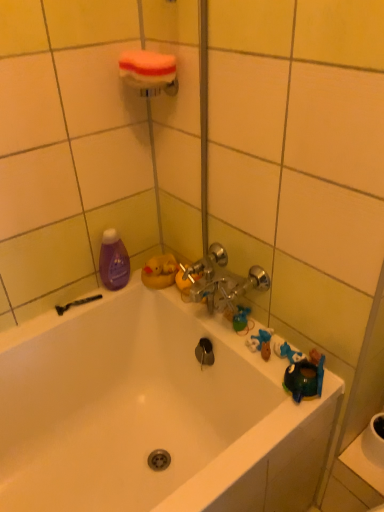
This screenshot has width=384, height=512. What do you see at coordinates (364, 464) in the screenshot?
I see `white glossy sink at lower right` at bounding box center [364, 464].

Image resolution: width=384 pixels, height=512 pixels. I want to click on white foam sponge at upper center, so click(x=149, y=72).

This screenshot has width=384, height=512. Find the location of `white glossy sink at lower right`. white glossy sink at lower right is located at coordinates (364, 464).

Can you confirm if purple glossy bottle at left is wider than white glossy sink at lower right?

Incorrect, the width of purple glossy bottle at left does not surpass that of white glossy sink at lower right.

Which object is closer to the camera, purple glossy bottle at left or white glossy sink at lower right?

white glossy sink at lower right.

Locate an element on the screen. cleaning product on the left of white glossy sink at lower right is located at coordinates (113, 261).

In terms of height, does white glossy sink at lower right look taller or shorter compared to purple glossy bottle at left?

In the image, white glossy sink at lower right appears to be shorter than purple glossy bottle at left.

Consider the image. From a real-world perspective, who is located higher, white glossy sink at lower right or purple glossy bottle at left?

purple glossy bottle at left, from a real-world perspective.

Would you say white glossy sink at lower right is a long distance from purple glossy bottle at left?

They are positioned close to each other.

Which is behind, point (303, 450) or point (381, 489)?

The point (381, 489) is more distant.

From the picture: What's the angular difference between white glossy bathtub at center and white glossy sink at lower right's facing directions?

The angle between the facing direction of white glossy bathtub at center and the facing direction of white glossy sink at lower right is 88.8 degrees.

Between white glossy bathtub at center and white glossy sink at lower right, which one has larger size?

With larger size is white glossy bathtub at center.

Is white glossy bathtub at center positioned with its back to white glossy sink at lower right?

No, white glossy sink at lower right is not at the back of white glossy bathtub at center.

In the scene shown: In the image, is white foam sponge at upper center on the left side or the right side of white glossy sink at lower right?

In the image, white foam sponge at upper center appears on the left side of white glossy sink at lower right.

Does white foam sponge at upper center contain white glossy sink at lower right?

No, white glossy sink at lower right is not inside white foam sponge at upper center.

From a real-world perspective, who is located higher, white foam sponge at upper center or white glossy sink at lower right?

white foam sponge at upper center, from a real-world perspective.

Considering the sizes of objects white foam sponge at upper center and purple glossy bottle at left in the image provided, who is thinner, white foam sponge at upper center or purple glossy bottle at left?

purple glossy bottle at left.

Is the position of white foam sponge at upper center more distant than that of purple glossy bottle at left?

No, it is not.

From the image's perspective, between white foam sponge at upper center and purple glossy bottle at left, which one is located above?

From the image's view, white foam sponge at upper center is above.

This screenshot has height=512, width=384. I want to click on towel bar that is above the white glossy bathtub at center (from a real-world perspective), so click(x=149, y=72).

Considering the positions of objects white glossy bathtub at center and white foam sponge at upper center in the image provided, who is behind, white glossy bathtub at center or white foam sponge at upper center?

white foam sponge at upper center is behind.

Who is shorter, white glossy bathtub at center or white foam sponge at upper center?

white foam sponge at upper center.

Can you tell me how much white glossy bathtub at center and white foam sponge at upper center differ in facing direction?

The facing directions of white glossy bathtub at center and white foam sponge at upper center are 89.6 degrees apart.

How different are the orientations of white glossy bathtub at center and purple glossy bottle at left in degrees?

There is a 0.0319-degree angle between the facing directions of white glossy bathtub at center and purple glossy bottle at left.

Looking at this image, is white glossy bathtub at center far from purple glossy bottle at left?

No, white glossy bathtub at center is in close proximity to purple glossy bottle at left.

The height and width of the screenshot is (512, 384). In order to click on cleaning product that appears on the left of white glossy bathtub at center in this screenshot , I will do `click(113, 261)`.

Between point (108, 455) and point (113, 257), which one is positioned in front?

The point (113, 257) is in front.

I want to click on sink below the purple glossy bottle at left (from a real-world perspective), so click(x=364, y=464).

I want to click on sink on the right of the purple glossy bottle at left, so click(364, 464).

Based on their spatial positions, is white glossy sink at lower right or white glossy bathtub at center closer to white foam sponge at upper center?

Based on the image, white glossy bathtub at center appears to be nearer to white foam sponge at upper center.

Estimate the real-world distances between objects in this image. Which object is further from purple glossy bottle at left, white glossy sink at lower right or white foam sponge at upper center?

white glossy sink at lower right is positioned further to the anchor purple glossy bottle at left.

Looking at the image, which one is located further to white glossy sink at lower right, purple glossy bottle at left or white foam sponge at upper center?

Based on the image, white foam sponge at upper center appears to be further to white glossy sink at lower right.

From the image, which object appears to be farther from white glossy sink at lower right, purple glossy bottle at left or white glossy bathtub at center?

Based on the image, purple glossy bottle at left appears to be further to white glossy sink at lower right.

Based on their spatial positions, is white foam sponge at upper center or white glossy sink at lower right further from white glossy bathtub at center?

The object further to white glossy bathtub at center is white foam sponge at upper center.

Looking at the image, which one is located closer to white glossy bathtub at center, white glossy sink at lower right or purple glossy bottle at left?

purple glossy bottle at left is positioned closer to the anchor white glossy bathtub at center.

Looking at the image, which one is located further to white glossy bathtub at center, purple glossy bottle at left or white glossy sink at lower right?

The object further to white glossy bathtub at center is white glossy sink at lower right.

Estimate the real-world distances between objects in this image. Which object is further from purple glossy bottle at left, white glossy bathtub at center or white glossy sink at lower right?

Based on the image, white glossy sink at lower right appears to be further to purple glossy bottle at left.

This screenshot has height=512, width=384. I want to click on bathtub between white foam sponge at upper center and white glossy sink at lower right vertically, so click(x=152, y=413).

The height and width of the screenshot is (512, 384). In order to click on bathtub between purple glossy bottle at left and white glossy sink at lower right in this screenshot , I will do `click(152, 413)`.

The image size is (384, 512). In order to click on cleaning product between white foam sponge at upper center and white glossy bathtub at center in the up-down direction in this screenshot , I will do `click(113, 261)`.

You are a GUI agent. You are given a task and a screenshot of the screen. Output one action in this format:
    pyautogui.click(x=<x>, y=<y>)
    Task: Click on the cleaning product between white foam sponge at upper center and white glossy sink at lower right from top to bottom
    Image resolution: width=384 pixels, height=512 pixels.
    Given the screenshot: What is the action you would take?
    pyautogui.click(x=113, y=261)